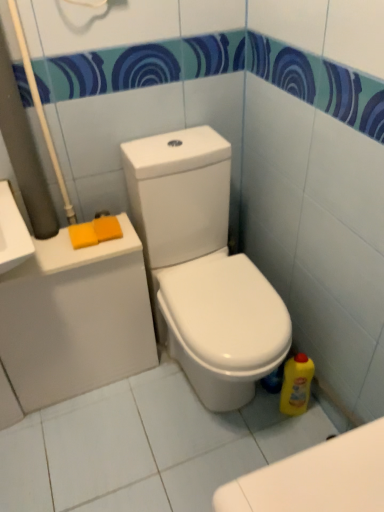
Identify the location of free space to the left of orange sponge at left, the first soap in the left-to-right sequence. This screenshot has width=384, height=512. (50, 245).